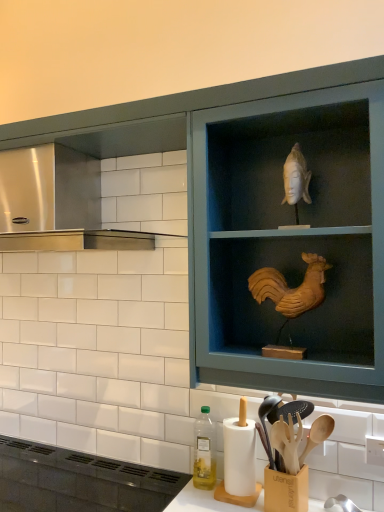
Question: From the image's perspective, is matte black vent at lower left above wooden cabinet at upper center?

Choices:
 (A) yes
 (B) no

Answer: (B)

Question: Is matte black vent at lower left bigger than wooden cabinet at upper center?

Choices:
 (A) yes
 (B) no

Answer: (B)

Question: Is matte black vent at lower left thinner than wooden cabinet at upper center?

Choices:
 (A) no
 (B) yes

Answer: (A)

Question: From a real-world perspective, is matte black vent at lower left under wooden cabinet at upper center?

Choices:
 (A) yes
 (B) no

Answer: (A)

Question: Would you say matte black vent at lower left is a long distance from wooden cabinet at upper center?

Choices:
 (A) yes
 (B) no

Answer: (B)

Question: Does point (367, 392) appear closer or farther from the camera than point (49, 242)?

Choices:
 (A) farther
 (B) closer

Answer: (B)

Question: From the image's perspective, relative to stainless steel vent at upper left, is wooden cabinet at upper center above or below?

Choices:
 (A) above
 (B) below

Answer: (B)

Question: In the image, is wooden cabinet at upper center on the left side or the right side of stainless steel vent at upper left?

Choices:
 (A) right
 (B) left

Answer: (A)

Question: Considering the positions of wooden cabinet at upper center and stainless steel vent at upper left in the image, is wooden cabinet at upper center taller or shorter than stainless steel vent at upper left?

Choices:
 (A) short
 (B) tall

Answer: (B)

Question: Is point (198, 106) positioned closer to the camera than point (193, 440)?

Choices:
 (A) farther
 (B) closer

Answer: (B)

Question: Is wooden cabinet at upper center to the left or to the right of translucent plastic bottle at lower center in the image?

Choices:
 (A) left
 (B) right

Answer: (A)

Question: From the image's perspective, is wooden cabinet at upper center located above or below translucent plastic bottle at lower center?

Choices:
 (A) below
 (B) above

Answer: (B)

Question: Is wooden cabinet at upper center wider or thinner than translucent plastic bottle at lower center?

Choices:
 (A) thin
 (B) wide

Answer: (A)

Question: Would you say wooden rooster at upper right is to the left or to the right of matte black vent at lower left in the picture?

Choices:
 (A) left
 (B) right

Answer: (B)

Question: Is wooden rooster at upper right wider or thinner than matte black vent at lower left?

Choices:
 (A) thin
 (B) wide

Answer: (A)